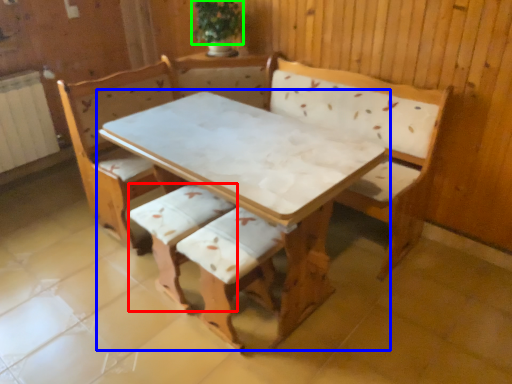
Question: Estimate the real-world distances between objects in this image. Which object is farther from armchair (highlighted by a red box), table (highlighted by a blue box) or plant (highlighted by a green box)?

Choices:
 (A) table
 (B) plant

Answer: (B)